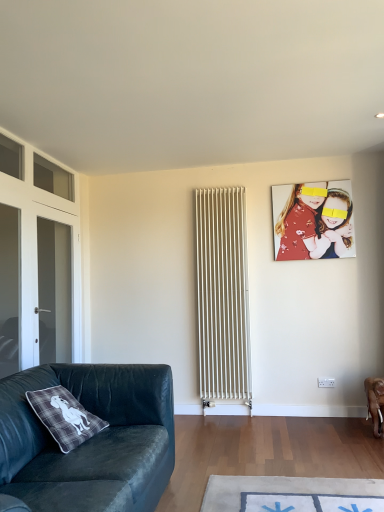
Question: Is transparent glass door at left, which is counted as the first glass door, starting from the front, turned away from matte red shirt at upper right?

Choices:
 (A) yes
 (B) no

Answer: (B)

Question: Is transparent glass door at left, which is counted as the second glass door, starting from the back, oriented towards matte red shirt at upper right?

Choices:
 (A) yes
 (B) no

Answer: (B)

Question: From a real-world perspective, is transparent glass door at left, which is counted as the second glass door, starting from the back, located higher than matte red shirt at upper right?

Choices:
 (A) yes
 (B) no

Answer: (B)

Question: Is transparent glass door at left, which is counted as the first glass door, starting from the front, smaller than matte red shirt at upper right?

Choices:
 (A) no
 (B) yes

Answer: (B)

Question: From the image's perspective, does transparent glass door at left, which is counted as the first glass door, starting from the front, appear lower than matte red shirt at upper right?

Choices:
 (A) yes
 (B) no

Answer: (A)

Question: Is transparent glass door at left, which is counted as the second glass door, starting from the back, bigger or smaller than velvet dark green couch at lower left?

Choices:
 (A) big
 (B) small

Answer: (B)

Question: From the image's perspective, is transparent glass door at left, which is counted as the second glass door, starting from the back, above or below velvet dark green couch at lower left?

Choices:
 (A) below
 (B) above

Answer: (B)

Question: In terms of height, does transparent glass door at left, which is counted as the first glass door, starting from the front, look taller or shorter compared to velvet dark green couch at lower left?

Choices:
 (A) short
 (B) tall

Answer: (B)

Question: Is point (18, 327) positioned closer to the camera than point (112, 487)?

Choices:
 (A) closer
 (B) farther

Answer: (B)

Question: Would you say transparent glass door at left, the second glass door positioned from the front, is inside or outside velvet dark green couch at lower left?

Choices:
 (A) inside
 (B) outside

Answer: (B)

Question: From their relative heights in the image, would you say transparent glass door at left, the second glass door positioned from the front, is taller or shorter than velvet dark green couch at lower left?

Choices:
 (A) short
 (B) tall

Answer: (B)

Question: In terms of size, does transparent glass door at left, the second glass door positioned from the front, appear bigger or smaller than velvet dark green couch at lower left?

Choices:
 (A) small
 (B) big

Answer: (A)

Question: Does point (8, 345) appear closer or farther from the camera than point (81, 490)?

Choices:
 (A) closer
 (B) farther

Answer: (B)

Question: Is velvet dark green couch at lower left bigger or smaller than matte red shirt at upper right?

Choices:
 (A) big
 (B) small

Answer: (A)

Question: From a real-world perspective, relative to matte red shirt at upper right, is velvet dark green couch at lower left vertically above or below?

Choices:
 (A) below
 (B) above

Answer: (A)